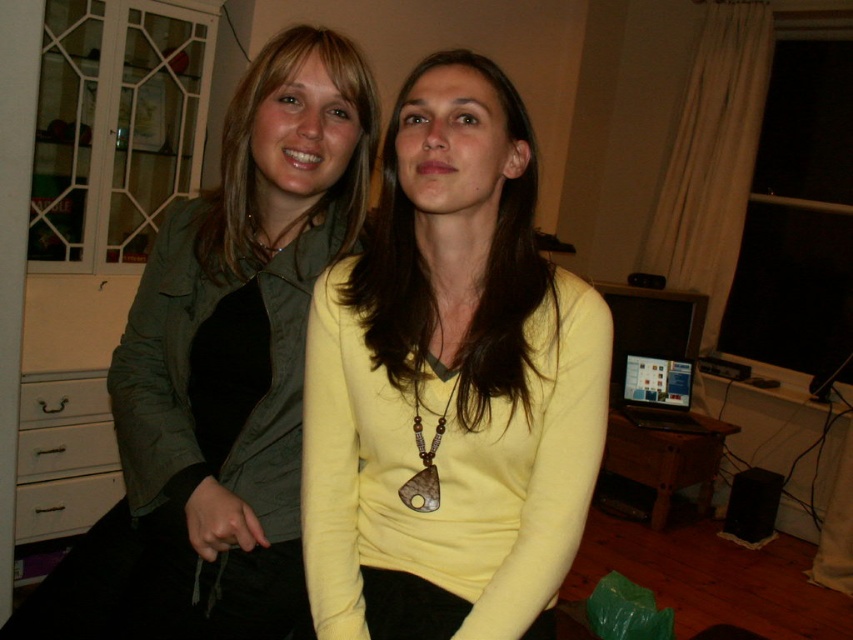
You are standing in the living room and want to place a small plant between the two points, point (454, 134) and point (412, 378). Which point should you place the plant closer to so that it appears closer to you?

You should place the plant closer to point (454, 134) because it is closer to the viewer than point (412, 378).

You are a delivery person who needs to place a small package on the yellow matte sweater at center. The package requires a surface at least 1 meter away from the viewer. Can you place it there?

The yellow matte sweater at center is 91.43 centimeters away from the viewer, which is less than 1 meter. Therefore, the package cannot be placed there as it does not meet the required distance.

Please look at the two sweaters in the image. The yellow matte sweater at center and the matte yellow sweater at center. Which one is located to the right?

The yellow matte sweater at center is located to the right of the matte yellow sweater at center.